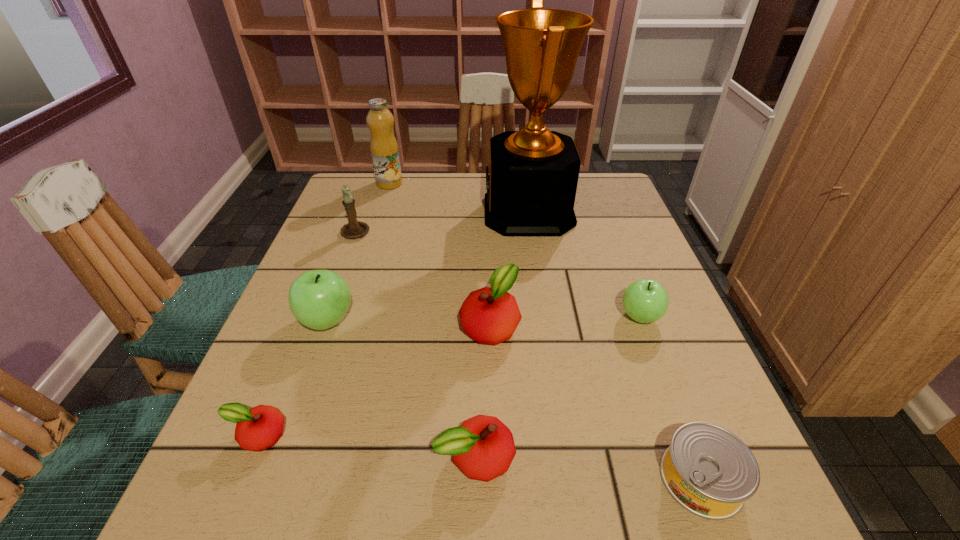
At what (x,y) coordinates should I click in order to perform the action: click on the leftmost red apple. Please return your answer as a coordinate pair (x, y). Looking at the image, I should click on (258, 428).

The width and height of the screenshot is (960, 540). I want to click on the shortest apple, so click(x=258, y=428).

The image size is (960, 540). I want to click on can, so click(708, 470).

Where is `vacant space located 0.190m on the front of the trophy cup with the label`? vacant space located 0.190m on the front of the trophy cup with the label is located at coordinates (414, 212).

This screenshot has width=960, height=540. In order to click on vacant space situated on the front of the trophy cup with the label in this screenshot , I will do `click(444, 212)`.

What are the coordinates of `vacant region located on the front of the trophy cup with the label` in the screenshot? It's located at (403, 212).

You are a GUI agent. You are given a task and a screenshot of the screen. Output one action in this format:
    pyautogui.click(x=<x>, y=<y>)
    Task: Click on the free space located 0.380m on the front label of the fruit juice
    Image resolution: width=960 pixels, height=540 pixels.
    Given the screenshot: What is the action you would take?
    pyautogui.click(x=532, y=184)

I want to click on vacant space situated 0.110m on the side of the candle holder with the handle, so click(x=368, y=199).

Locate an element on the screen. This screenshot has width=960, height=540. vacant position located on the side of the candle holder with the handle is located at coordinates (366, 205).

Locate an element on the screen. vacant area located 0.250m on the side of the candle holder with the handle is located at coordinates (376, 174).